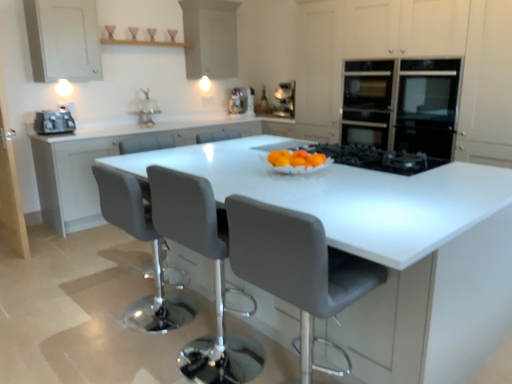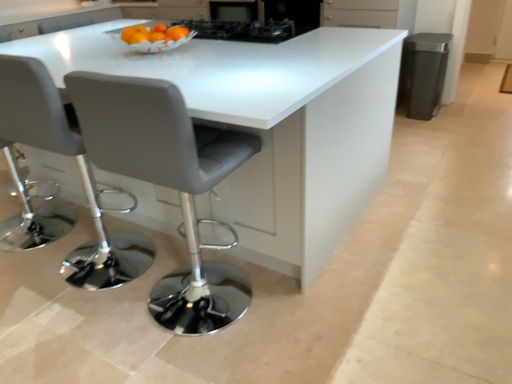
Question: Which way did the camera rotate in the video?

Choices:
 (A) rotated upward
 (B) rotated downward

Answer: (B)